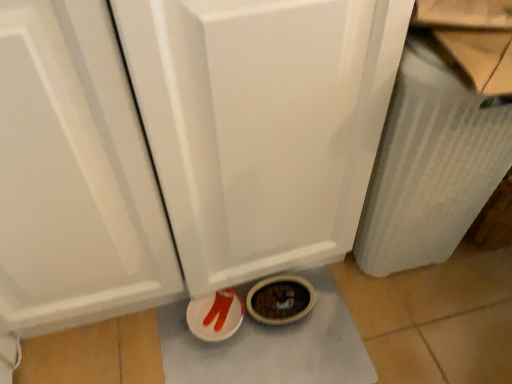
This screenshot has width=512, height=384. Find the location of `vacant area located to the right-hand side of matte plastic shoes at lower center`. vacant area located to the right-hand side of matte plastic shoes at lower center is located at coordinates (303, 340).